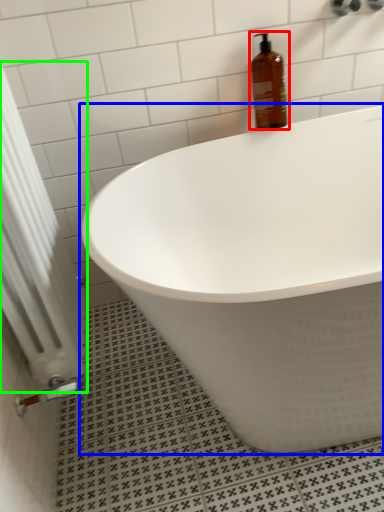
Question: Which is nearer to the bottle (highlighted by a red box)? bathtub (highlighted by a blue box) or radiator (highlighted by a green box).

Choices:
 (A) bathtub
 (B) radiator

Answer: (A)